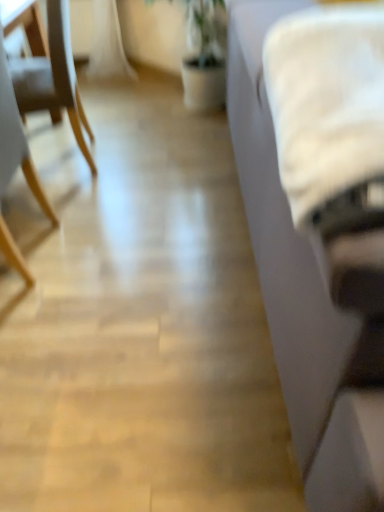
The width and height of the screenshot is (384, 512). In order to click on free space in front of light wood chair at left, which is the second chair from front to back in this screenshot , I will do `click(91, 200)`.